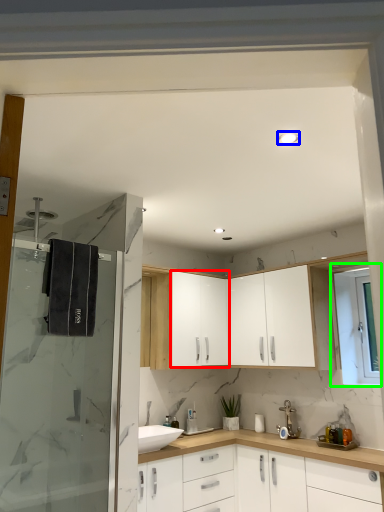
Question: Considering the real-world distances, which object is farthest from cabinetry (highlighted by a red box)? light fixture (highlighted by a blue box) or window (highlighted by a green box)?

Choices:
 (A) light fixture
 (B) window

Answer: (A)